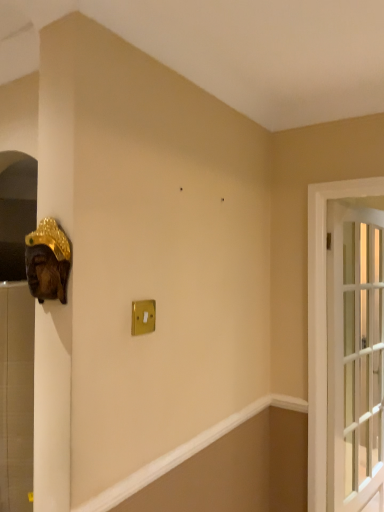
Question: From the image's perspective, is gold metallic light switch at center on clear glass door at right?

Choices:
 (A) no
 (B) yes

Answer: (B)

Question: From a real-world perspective, is gold metallic light switch at center beneath clear glass door at right?

Choices:
 (A) yes
 (B) no

Answer: (B)

Question: Is the position of gold metallic light switch at center more distant than that of clear glass door at right?

Choices:
 (A) yes
 (B) no

Answer: (B)

Question: Is gold metallic light switch at center outside of clear glass door at right?

Choices:
 (A) yes
 (B) no

Answer: (A)

Question: Is clear glass door at right completely or partially inside gold metallic light switch at center?

Choices:
 (A) yes
 (B) no

Answer: (B)

Question: Is gold metallic light switch at center at the left side of clear glass door at right?

Choices:
 (A) no
 (B) yes

Answer: (B)

Question: Is there a large distance between clear glass door at right and wooden mask at left?

Choices:
 (A) no
 (B) yes

Answer: (B)

Question: Is clear glass door at right facing away from wooden mask at left?

Choices:
 (A) yes
 (B) no

Answer: (B)

Question: From the image's perspective, does clear glass door at right appear lower than wooden mask at left?

Choices:
 (A) yes
 (B) no

Answer: (A)

Question: Is clear glass door at right located outside wooden mask at left?

Choices:
 (A) yes
 (B) no

Answer: (A)

Question: Would you say wooden mask at left is part of clear glass door at right's contents?

Choices:
 (A) yes
 (B) no

Answer: (B)

Question: Does clear glass door at right appear on the left side of wooden mask at left?

Choices:
 (A) no
 (B) yes

Answer: (A)

Question: Can you confirm if wooden mask at left is smaller than gold metallic light switch at center?

Choices:
 (A) no
 (B) yes

Answer: (A)